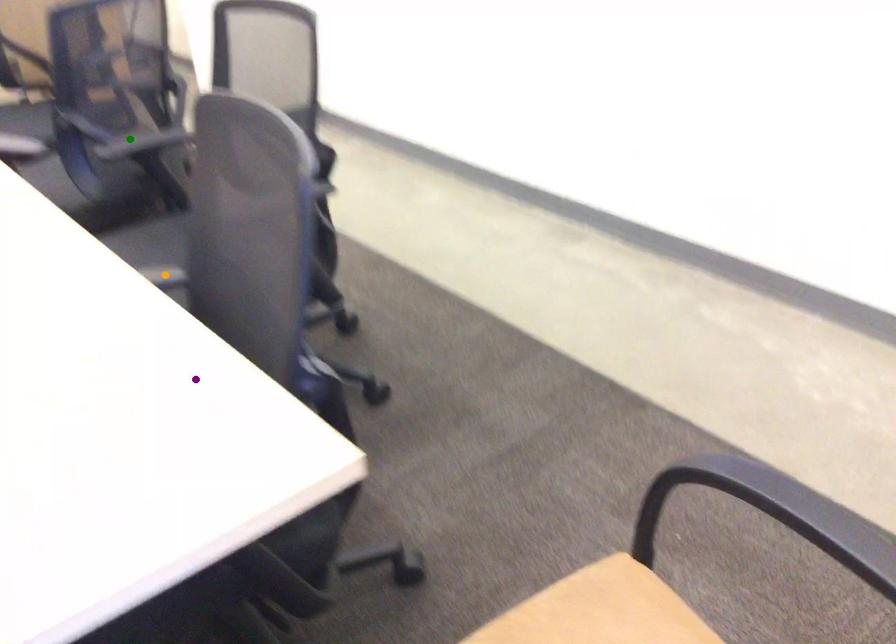
Order these from nearest to farthest:
- orange point
- purple point
- green point

green point, orange point, purple point